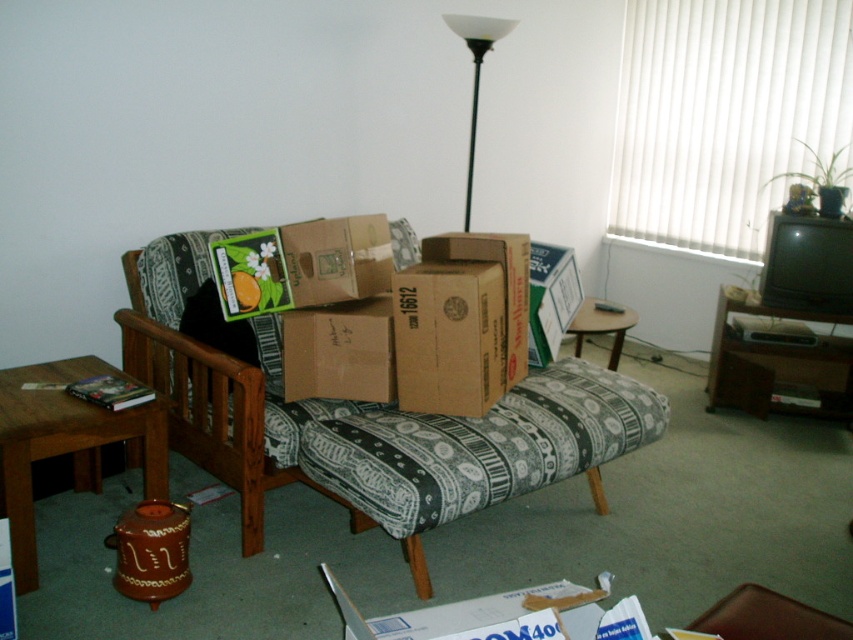
You are organizing a small gathering in the living room and need to place a large centerpiece on the table. Which table, the brown wooden table at lower left or the wooden round table at center, is more suitable for this purpose?

The brown wooden table at lower left is bigger than the wooden round table at center, so it is more suitable for placing a large centerpiece.

You are standing in the living room and want to place a new lamp on the wooden round table at center. To reach the table, do you need to step around the patterned fabric couch at center?

The patterned fabric couch at center is closer to the viewer than the wooden round table at center, so you would need to step around the patterned fabric couch at center to reach the wooden round table at center.

You are standing in the living room and want to place a 2 meter long ladder against the wall. The ladder is too long to carry through the room. Can you move the ladder from the entrance to the brown wooden table at lower left without tilting it?

The brown wooden table at lower left is 1.95 meters away from camera. Since the ladder is 2 meters long, it is slightly longer than the distance available, so you cannot move the ladder without tilting it.